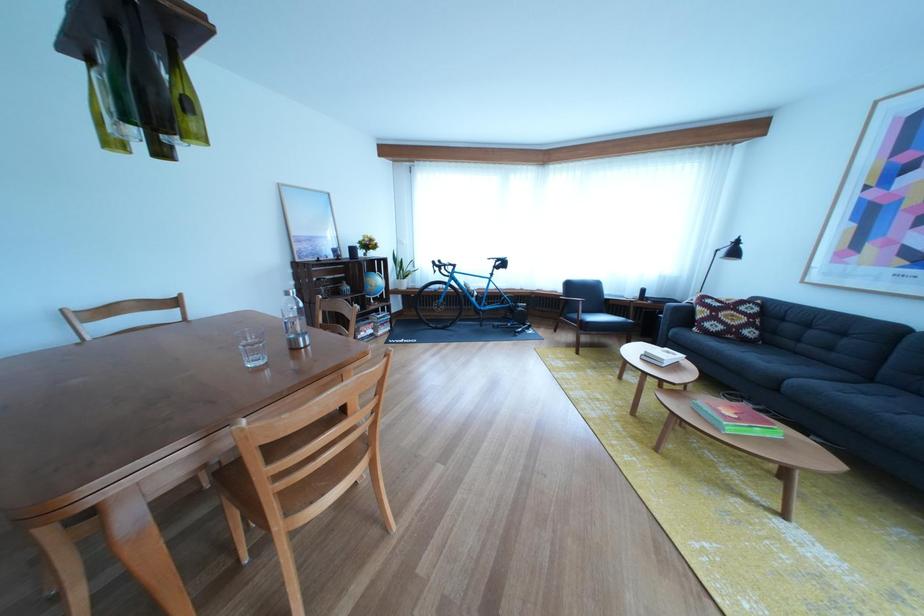
The height and width of the screenshot is (616, 924). What do you see at coordinates (497, 264) in the screenshot?
I see `the bicycle handlebar` at bounding box center [497, 264].